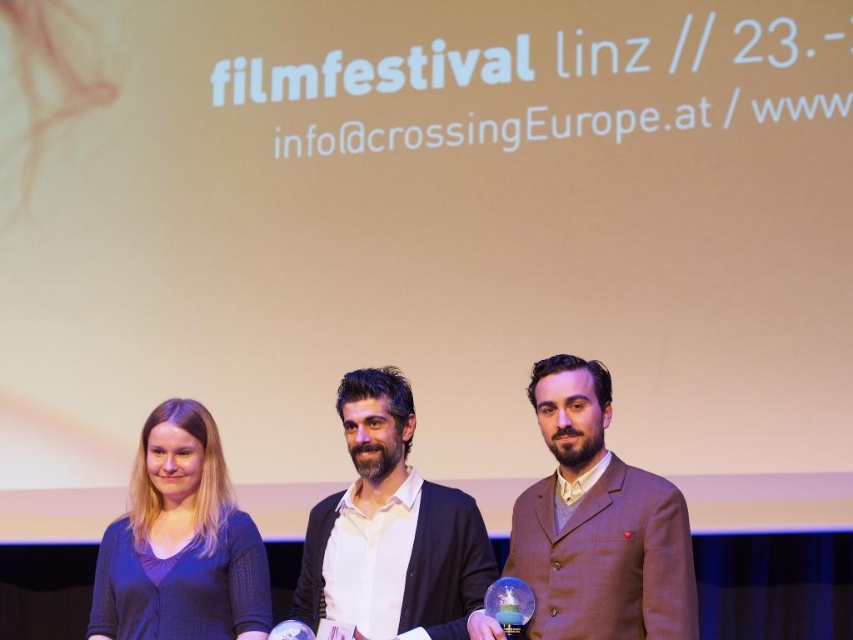
The scene shows a man wearing a brown wool suit at center and a white matte shirt at center. Which clothing item takes up more space visually?

The white matte shirt at center occupies more space than the brown wool suit at center.

You are an event photographer standing in the front row of the film festival audience. You want to capture a close shot of the brown wool suit at center without moving from your current position. Can you do this with a standard camera lens that has a maximum focal length of 200mm? Explain your reasoning.

The brown wool suit at center is 2.65 meters from the viewer. A standard camera lens with a maximum focal length of 200mm can effectively capture a close shot from this distance, so yes, it is possible to take the photo without moving.